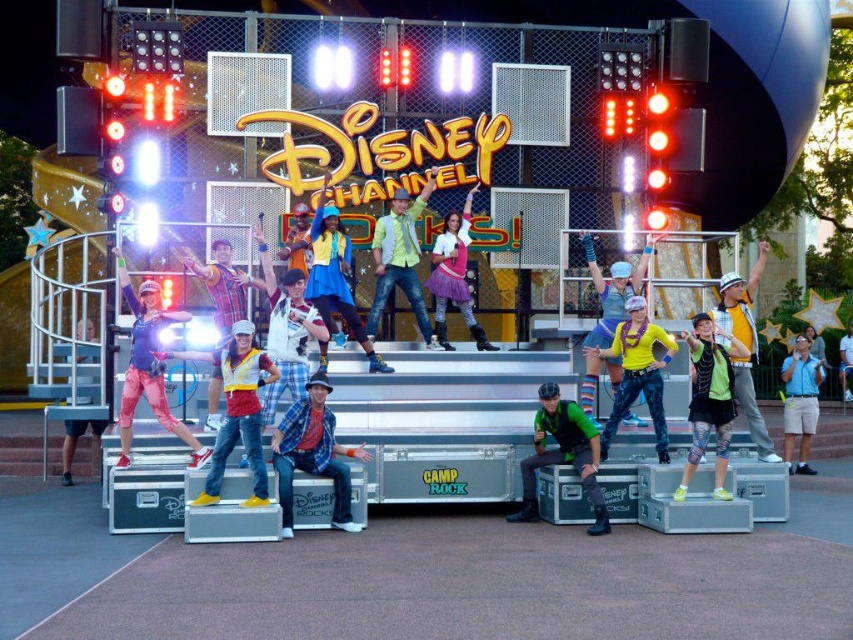
Question: Which of the following is the farthest from the observer?

Choices:
 (A) (593, 262)
 (B) (722, 369)

Answer: (A)

Question: Observing the image, what is the correct spatial positioning of yellow matte shirt at center in reference to shiny silver helmet at center?

Choices:
 (A) left
 (B) right

Answer: (A)

Question: Among these points, which one is nearest to the camera?

Choices:
 (A) (717, 440)
 (B) (808, 449)
 (C) (740, 401)

Answer: (A)

Question: Does shiny silver helmet at center have a lesser width compared to pink satin skirt at center?

Choices:
 (A) yes
 (B) no

Answer: (B)

Question: Which of the following is the closest to the observer?

Choices:
 (A) shiny silver helmet at center
 (B) green matte vest at center
 (C) yellow matte shirt at center
 (D) yellow shiny shirt at center

Answer: (B)

Question: Does green matte vest at center have a lesser width compared to light blue denim shorts at lower right?

Choices:
 (A) no
 (B) yes

Answer: (B)